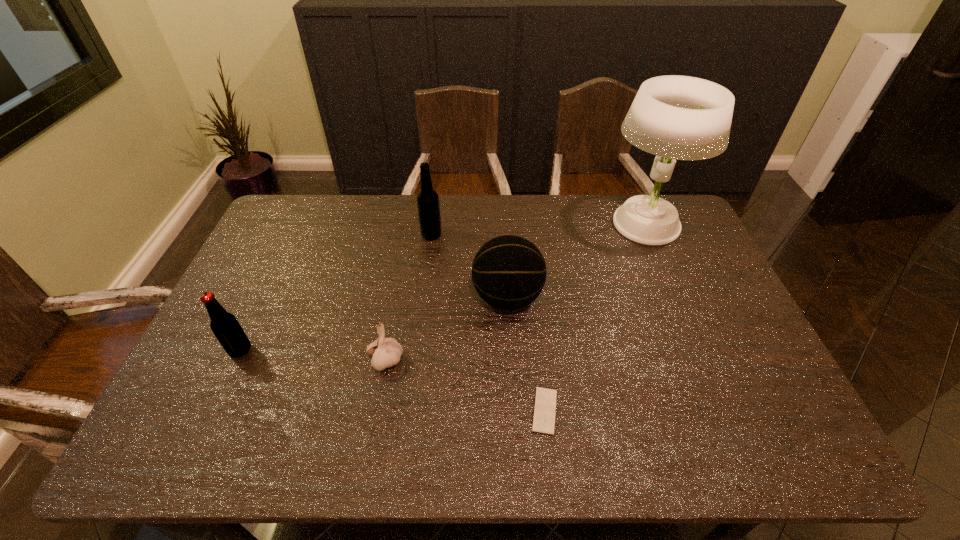
Identify the location of object positioned at the near edge. (545, 399).

The image size is (960, 540). Identify the location of object located in the left edge section of the desktop. (225, 326).

Where is `object that is at the right edge`? Image resolution: width=960 pixels, height=540 pixels. object that is at the right edge is located at coordinates (674, 117).

At what (x,y) coordinates should I click in order to perform the action: click on object that is at the far right corner. Please return your answer as a coordinate pair (x, y). This screenshot has width=960, height=540. Looking at the image, I should click on (674, 117).

Identify the location of free location at the far edge. The image size is (960, 540). (516, 213).

Where is `free spot at the near edge of the desktop`? free spot at the near edge of the desktop is located at coordinates (546, 442).

I want to click on vacant space at the left edge of the desktop, so click(222, 378).

The width and height of the screenshot is (960, 540). I want to click on vacant position at the right edge of the desktop, so click(754, 366).

Where is `vacant space at the near right corner of the desktop`? The image size is (960, 540). vacant space at the near right corner of the desktop is located at coordinates (743, 436).

Where is `free space between the left beer bottle and the lamp`? The height and width of the screenshot is (540, 960). free space between the left beer bottle and the lamp is located at coordinates (443, 287).